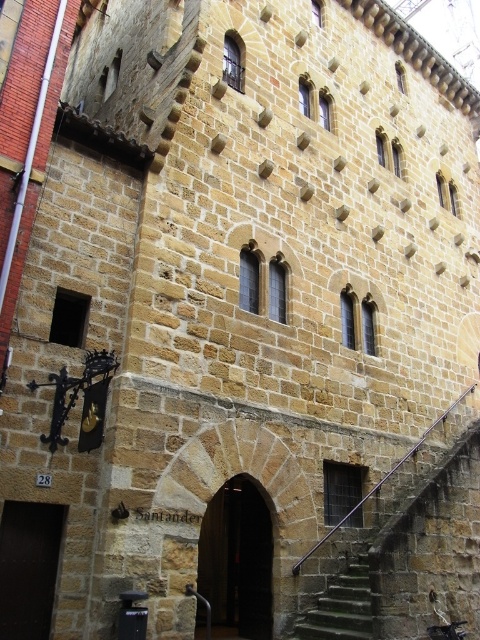
Question: Among these objects, which one is farthest from the camera?

Choices:
 (A) green mossy stone stairs at lower center
 (B) dark brown wooden door at lower left
 (C) green mossy stone stairs at lower right
 (D) dark brown stone archway at center

Answer: (A)

Question: Is green mossy stone stairs at lower right thinner than dark brown stone archway at center?

Choices:
 (A) no
 (B) yes

Answer: (A)

Question: Does green mossy stone stairs at lower right appear on the right side of dark brown stone archway at center?

Choices:
 (A) yes
 (B) no

Answer: (A)

Question: Estimate the real-world distances between objects in this image. Which object is closer to the green mossy stone stairs at lower center?

Choices:
 (A) green mossy stone stairs at lower right
 (B) dark brown wooden door at lower left

Answer: (A)

Question: Estimate the real-world distances between objects in this image. Which object is closer to the dark brown stone archway at center?

Choices:
 (A) dark brown wooden door at lower left
 (B) green mossy stone stairs at lower center
 (C) green mossy stone stairs at lower right

Answer: (B)

Question: Does green mossy stone stairs at lower right appear over green mossy stone stairs at lower center?

Choices:
 (A) yes
 (B) no

Answer: (A)